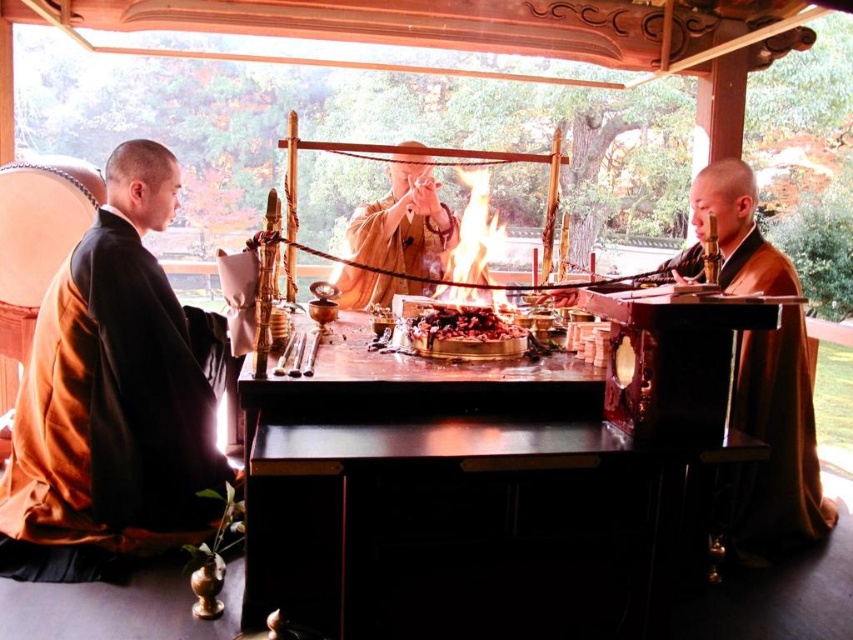
You are a visitor standing behind the orange silk robe at left and want to reach the charcoal ash at center without moving your feet. Can you do it with your hand?

The distance between the orange silk robe at left and the charcoal ash at center is 3.61 feet. Since 3.61 feet is approximately 43 inches, which is beyond the typical human arm reach of around 24 to 30 inches, you cannot reach the charcoal ash at center with your hand while staying in place.

You are a visitor observing the traditional Japanese ritual scene. You notice two individuals wearing orange silk robe at left and brown silk robe at right. Which individual is sitting closer to the altar?

The orange silk robe at left is taller than brown silk robe at right, so the individual wearing the orange silk robe at left is sitting closer to the altar.

You are a visitor standing at the entrance of the temple and want to place a small offering on the shiny dark wood table at center. However, you notice the orange silk robe at left is blocking your path. Can you easily reach the table without moving the robe?

The shiny dark wood table at center has a lesser height compared to orange silk robe at left, so the robe might block your view or access to the table. You might need to move the robe or find another way around to place the offering.